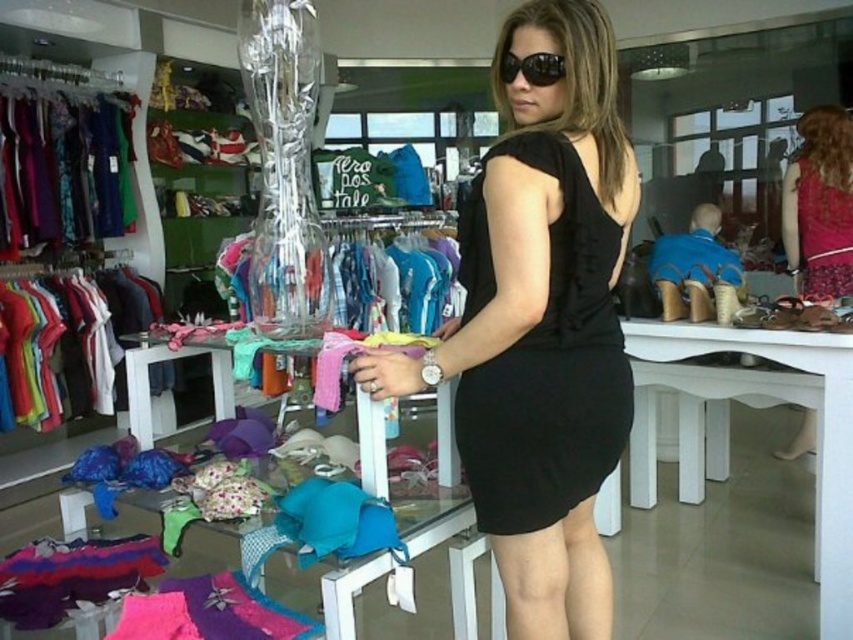
Which is above, black satin dress at center or floral fabric dress at center?

floral fabric dress at center is above.

Who is lower down, black satin dress at center or floral fabric dress at center?

black satin dress at center

Where is `black satin dress at center`? Image resolution: width=853 pixels, height=640 pixels. black satin dress at center is located at coordinates (544, 358).

Find the location of a particular element. black satin dress at center is located at coordinates (544, 358).

Can you confirm if floral fabric dress at center is positioned above black reflective sunglasses at center?

Incorrect, floral fabric dress at center is not positioned above black reflective sunglasses at center.

Does floral fabric dress at center come in front of black reflective sunglasses at center?

No, it is behind black reflective sunglasses at center.

You are a GUI agent. You are given a task and a screenshot of the screen. Output one action in this format:
    pyautogui.click(x=<x>, y=<y>)
    Task: Click on the floral fabric dress at center
    The width and height of the screenshot is (853, 640).
    Given the screenshot: What is the action you would take?
    pyautogui.click(x=822, y=232)

Does point (57, 234) come behind point (802, 202)?

Yes, it is behind point (802, 202).

Is point (62, 211) less distant than point (842, 289)?

No, it is not.

This screenshot has width=853, height=640. In order to click on matte purple dress at left in this screenshot , I will do `click(62, 163)`.